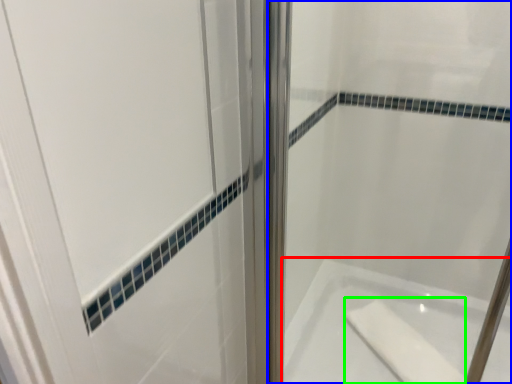
Question: Which object is the closest to the bathtub (highlighted by a red box)? Choose among these: shower door (highlighted by a blue box) or soap (highlighted by a green box).

Choices:
 (A) shower door
 (B) soap

Answer: (B)